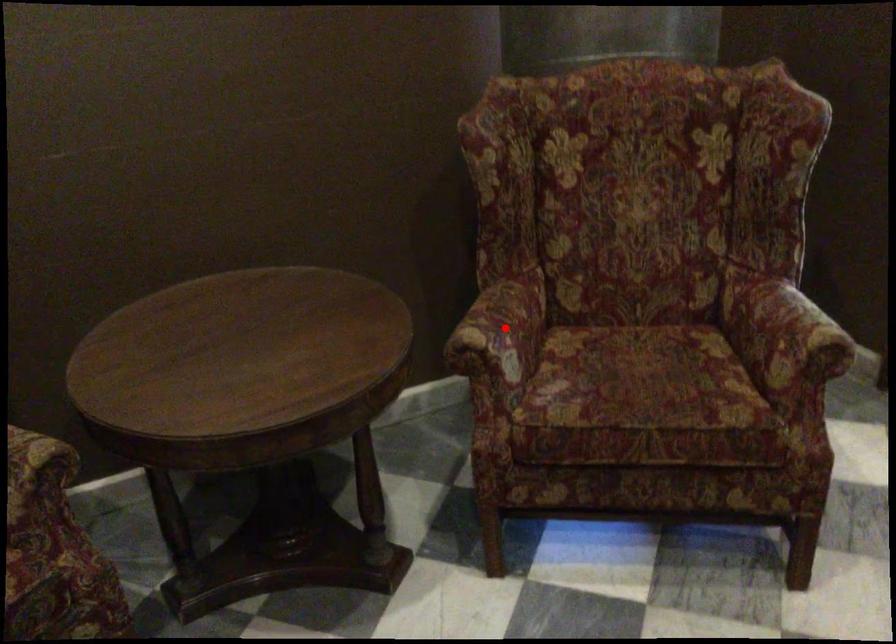
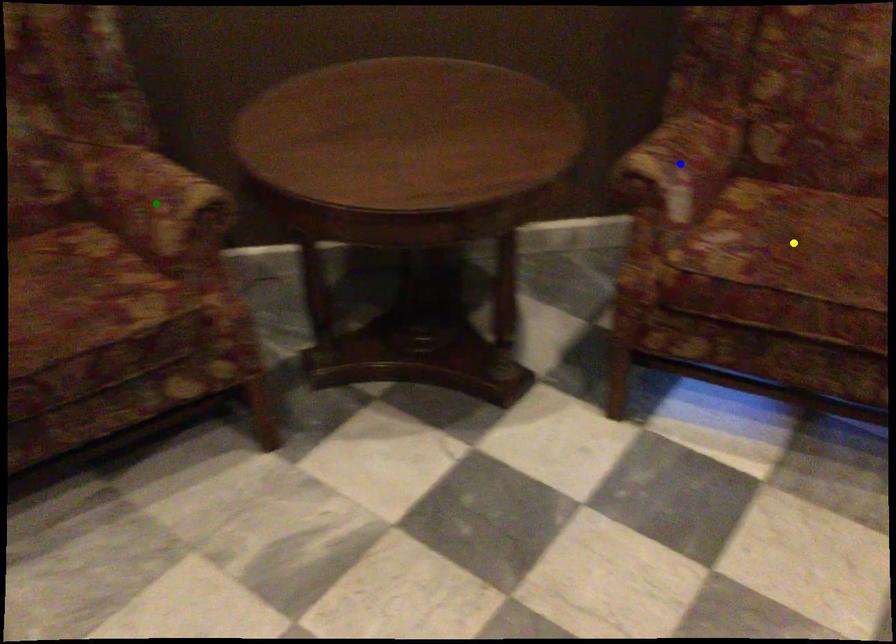
Question: I am providing you with two images of the same scene from different viewpoints. A red point is marked on the first image. You are given multiple points on the second image. Which point in image 2 is actually the same real-world point as the red point in image 1?

Choices:
 (A) yellow point
 (B) blue point
 (C) green point

Answer: (B)